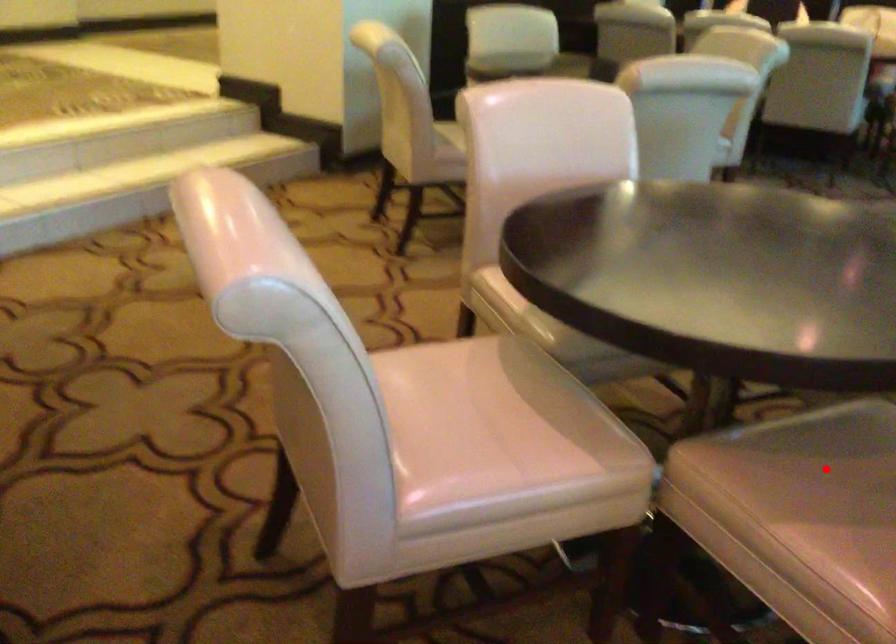
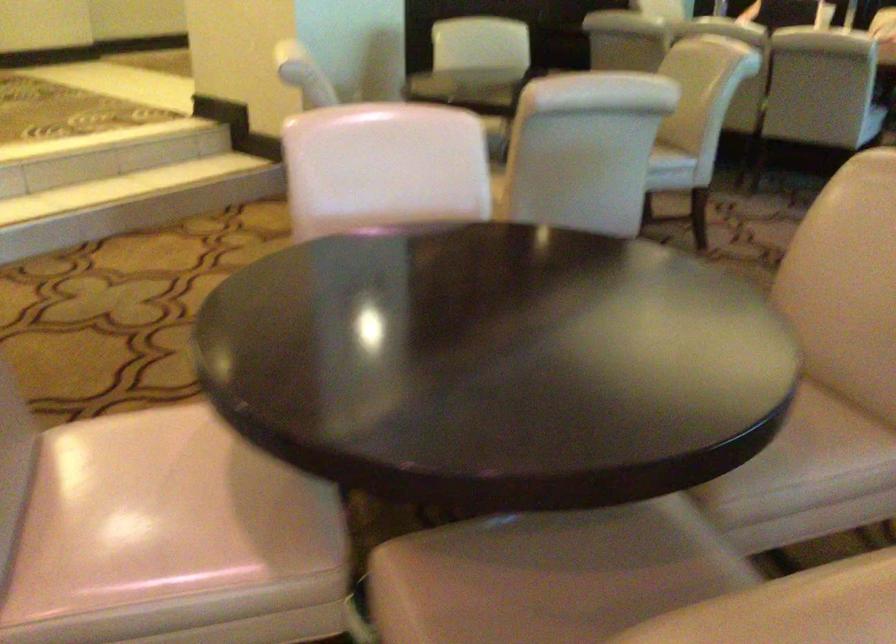
Where in the second image is the point corresponding to the highlighted location from the first image?

(556, 585)